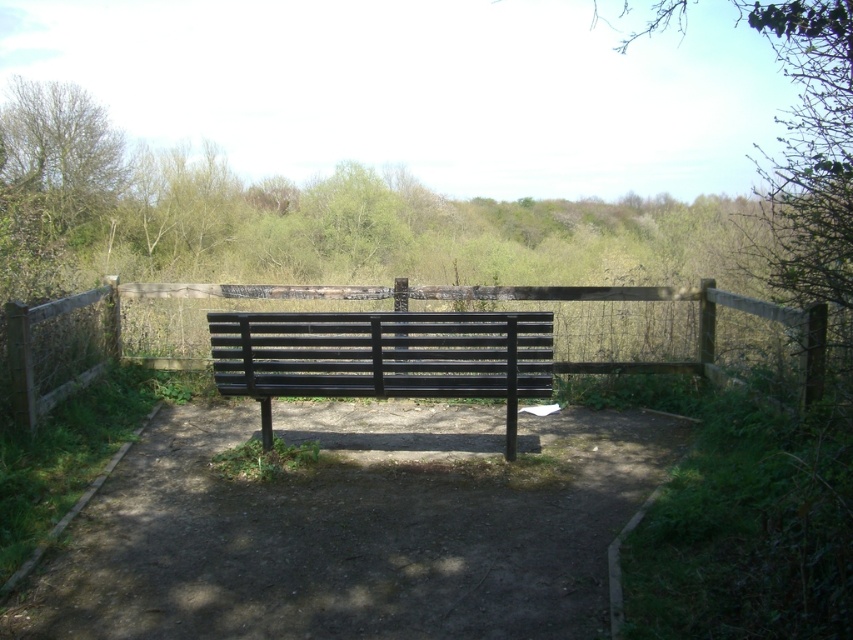
You are planning to place a new bench in the park. The existing black metal bench at center is smaller than the green leafy tree at upper left. Which object should you consider for size comparison when choosing the new bench?

You should compare the size of the new bench with the black metal bench at center because it is the existing bench and the green leafy tree at upper left is a different object type, making it unsuitable for size comparison.

You are standing at the edge of the dirt path at center and want to walk towards the green leafy tree at upper left. Which direction should you face to move towards it?

You should face towards the upper left direction to move towards the green leafy tree at upper left since it is located in that direction.